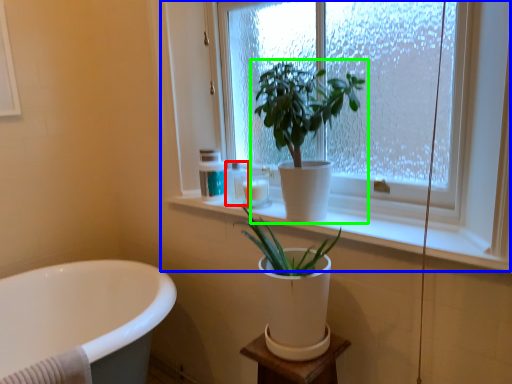
Question: Based on their relative distances, which object is nearer to toiletry (highlighted by a red box)? Choose from window (highlighted by a blue box) and houseplant (highlighted by a green box).

Choices:
 (A) window
 (B) houseplant

Answer: (B)